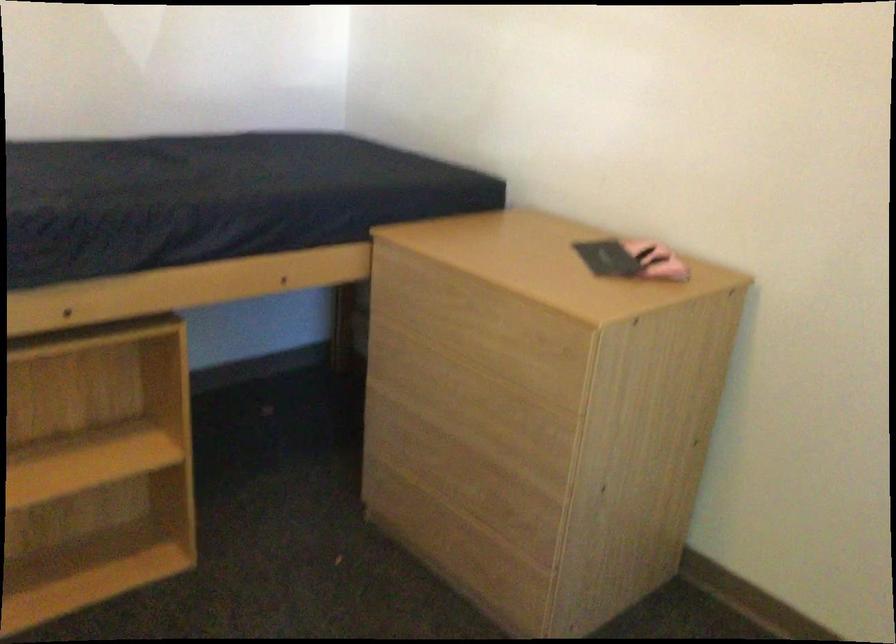
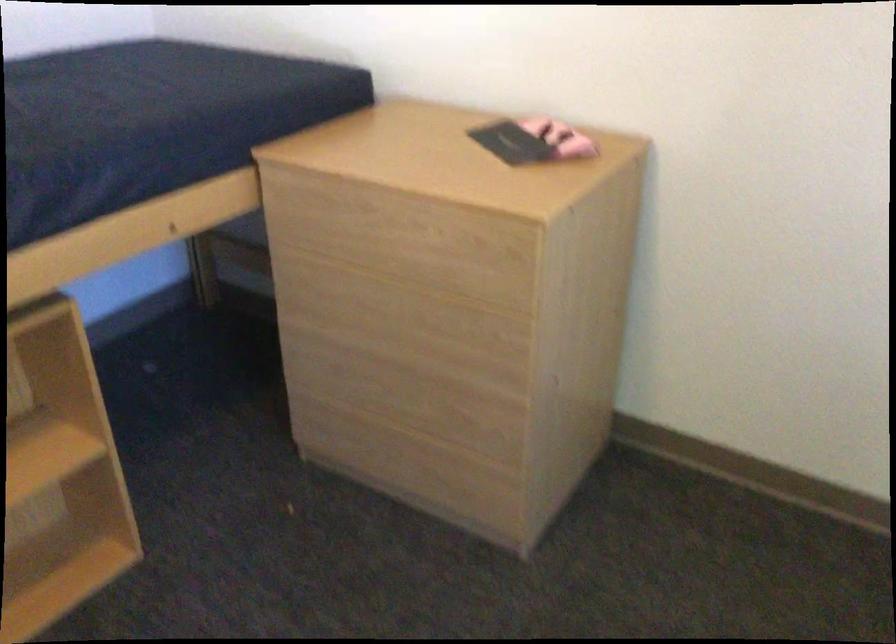
Where in the second image is the point corresponding to pixel 488 533 from the first image?

(451, 440)